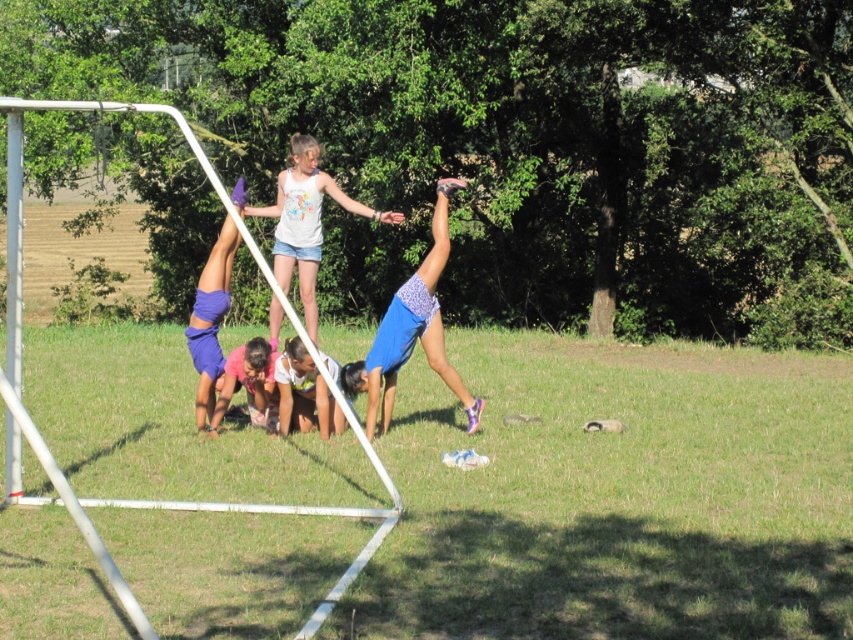
Question: Is white cotton tank top at upper center behind purple fabric shorts at left?

Choices:
 (A) yes
 (B) no

Answer: (A)

Question: Can you confirm if blue fabric shorts at center is positioned to the right of white cotton tank top at upper center?

Choices:
 (A) yes
 (B) no

Answer: (A)

Question: Which of these objects is positioned closest to the white cotton tank top at upper center?

Choices:
 (A) pink fabric at lower center
 (B) blue fabric shorts at center

Answer: (A)

Question: Which object is farther from the camera taking this photo?

Choices:
 (A) pink fabric at lower center
 (B) white cotton tank top at upper center

Answer: (B)

Question: Among these objects, which one is nearest to the camera?

Choices:
 (A) pink fabric at lower center
 (B) blue fabric shorts at center

Answer: (B)

Question: Is blue fabric shorts at center below purple fabric shorts at left?

Choices:
 (A) no
 (B) yes

Answer: (B)